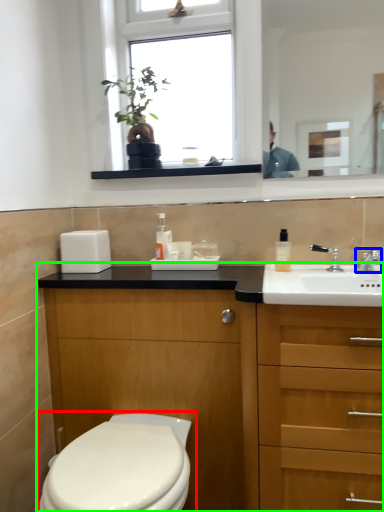
Question: Which object is positioned farthest from toilet (highlighted by a red box)? Select from tap (highlighted by a blue box) and bathroom cabinet (highlighted by a green box).

Choices:
 (A) tap
 (B) bathroom cabinet

Answer: (A)